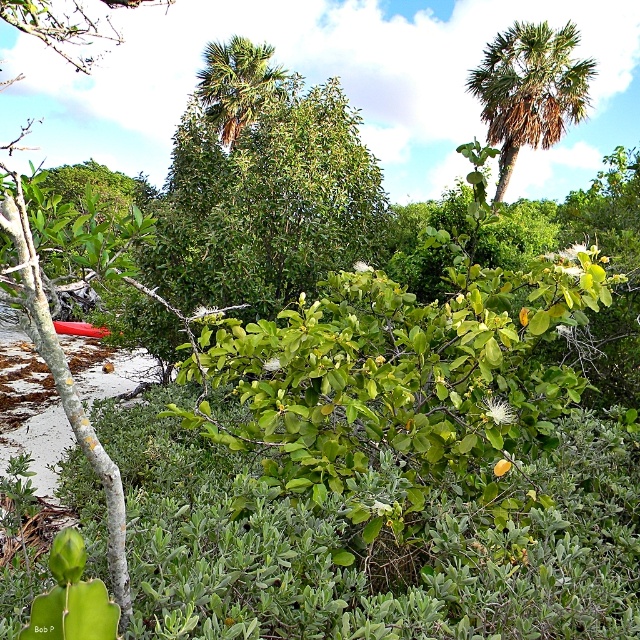
Question: Which of the following is the farthest from the observer?

Choices:
 (A) green leafy palm tree at upper center
 (B) green leafy bush at center
 (C) brown textured palm tree at upper right

Answer: (C)

Question: Among these points, which one is nearest to the camera?

Choices:
 (A) (202, 77)
 (B) (580, 108)
 (C) (272, 90)

Answer: (C)

Question: Observing the image, what is the correct spatial positioning of green leafy bush at center in reference to green leafy palm tree at upper center?

Choices:
 (A) above
 (B) below

Answer: (B)

Question: Can you confirm if brown textured palm tree at upper right is positioned to the left of green leafy palm tree at upper center?

Choices:
 (A) yes
 (B) no

Answer: (B)

Question: Which is farther from the green leafy bush at center?

Choices:
 (A) brown textured palm tree at upper right
 (B) green leafy palm tree at upper center

Answer: (A)

Question: Does green leafy bush at center come behind brown textured palm tree at upper right?

Choices:
 (A) no
 (B) yes

Answer: (A)